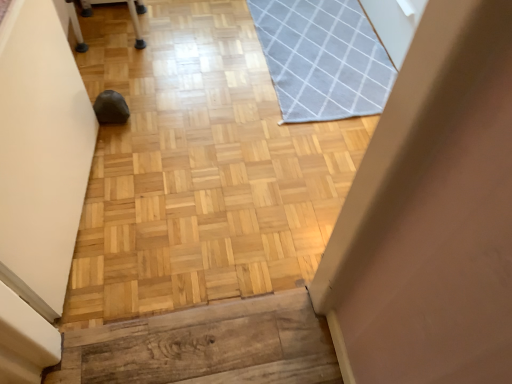
Locate an element on the screen. This screenshot has width=512, height=384. vacant space underneath matte white plastic chair at upper left (from a real-world perspective) is located at coordinates (112, 33).